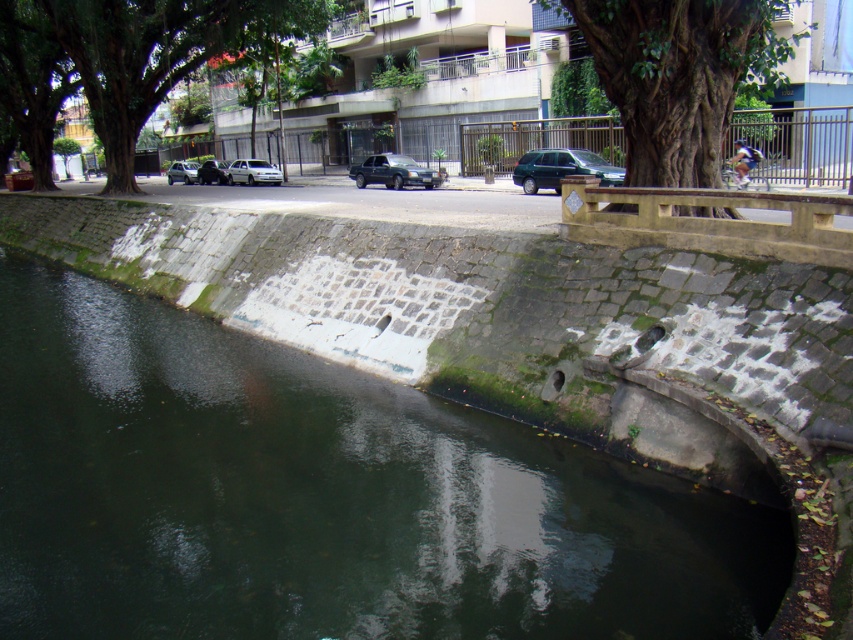
Question: Does metallic green suv at center right appear on the right side of silver metallic car at left?

Choices:
 (A) yes
 (B) no

Answer: (A)

Question: Does green leafy tree at upper left lie behind green rough bark tree at upper right?

Choices:
 (A) yes
 (B) no

Answer: (A)

Question: Which is nearer to the silver metallic car at left?

Choices:
 (A) green stone river at lower left
 (B) green rough bark tree at upper right
 (C) shiny dark blue sedan at center
 (D) shiny silver sedan at center

Answer: (D)

Question: Among these objects, which one is nearest to the camera?

Choices:
 (A) green stone river at lower left
 (B) metallic green suv at center right
 (C) green rough bark tree at upper right

Answer: (A)

Question: Is metallic green suv at center right positioned at the back of white matte car at center?

Choices:
 (A) yes
 (B) no

Answer: (B)

Question: Which object is farther from the camera taking this photo?

Choices:
 (A) green rough bark tree at upper right
 (B) silver metallic car at left
 (C) green stone river at lower left
 (D) green leafy tree at upper left

Answer: (B)